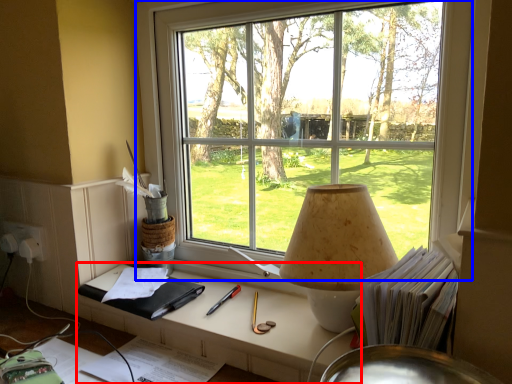
Question: Which object is further to the camera taking this photo, table (highlighted by a red box) or window (highlighted by a blue box)?

Choices:
 (A) table
 (B) window

Answer: (A)